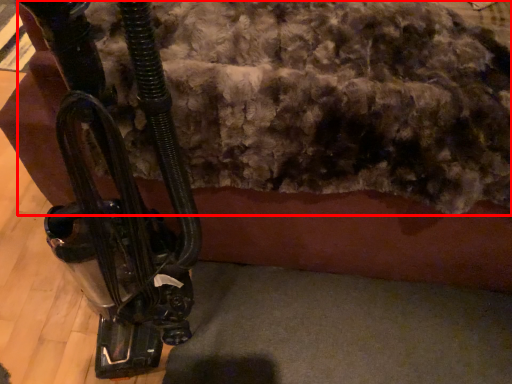
Question: From the image's perspective, considering the relative positions of wool (annotated by the red box) and vehicle in the image provided, where is wool (annotated by the red box) located with respect to the staircase?

Choices:
 (A) above
 (B) below

Answer: (A)